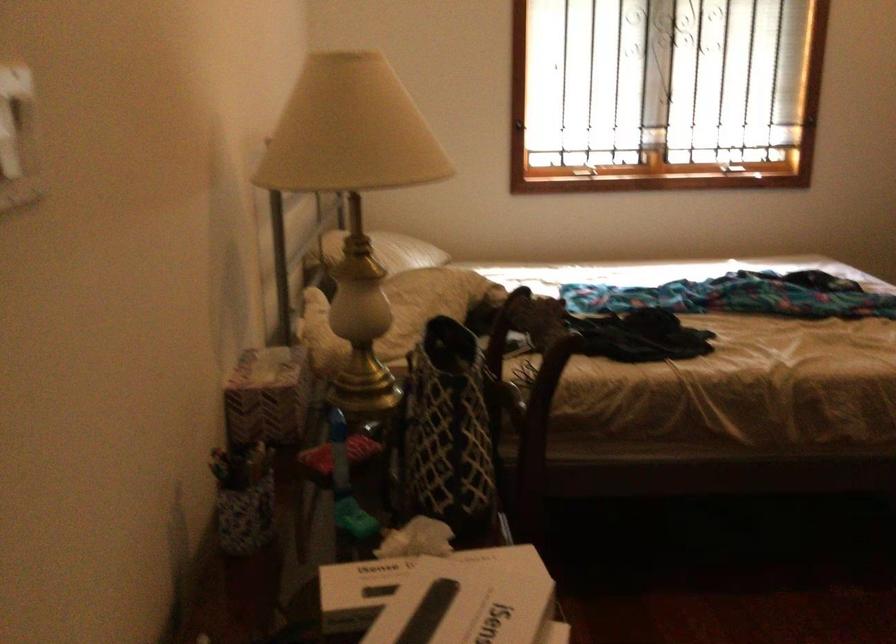
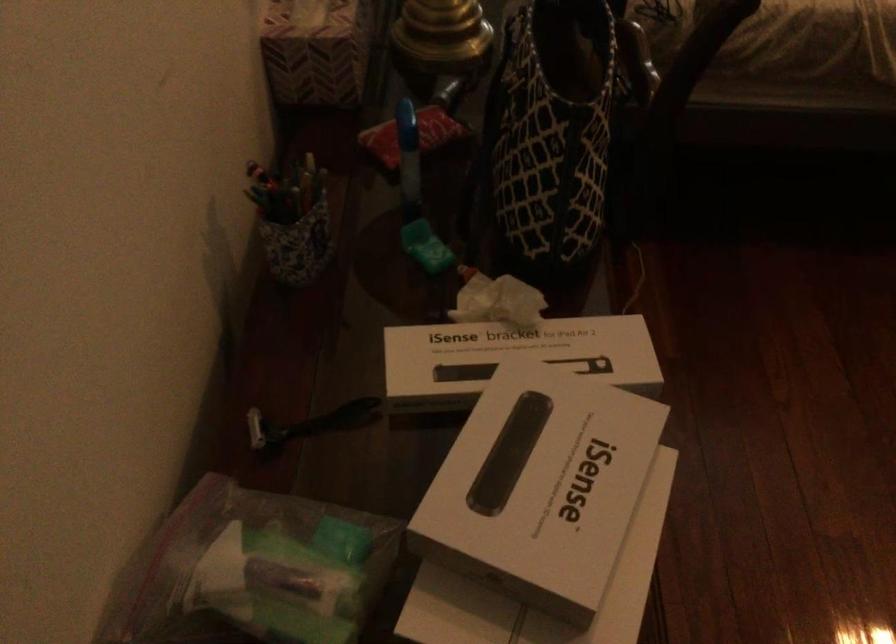
Where in the second image is the point corresponding to pixel 426 560 from the first image?

(515, 353)